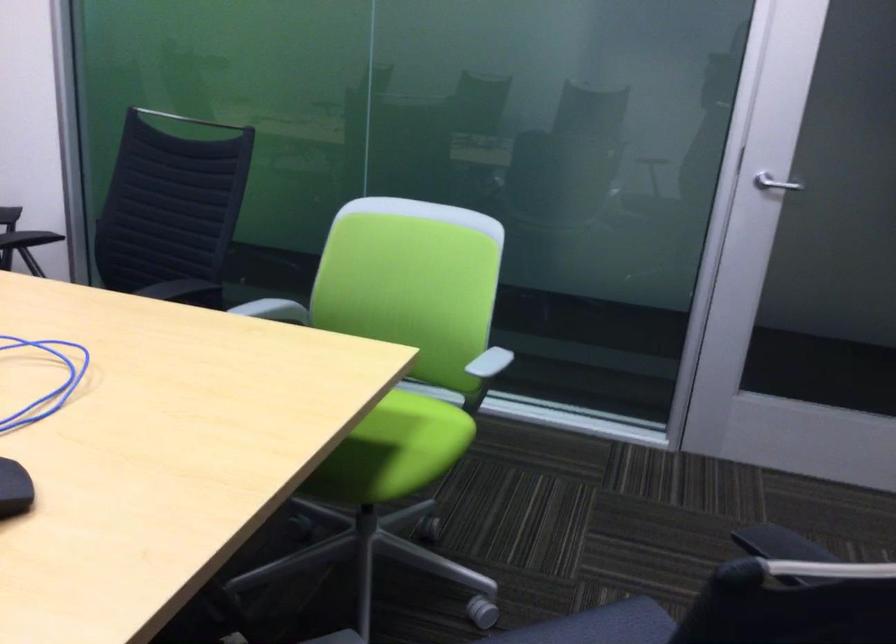
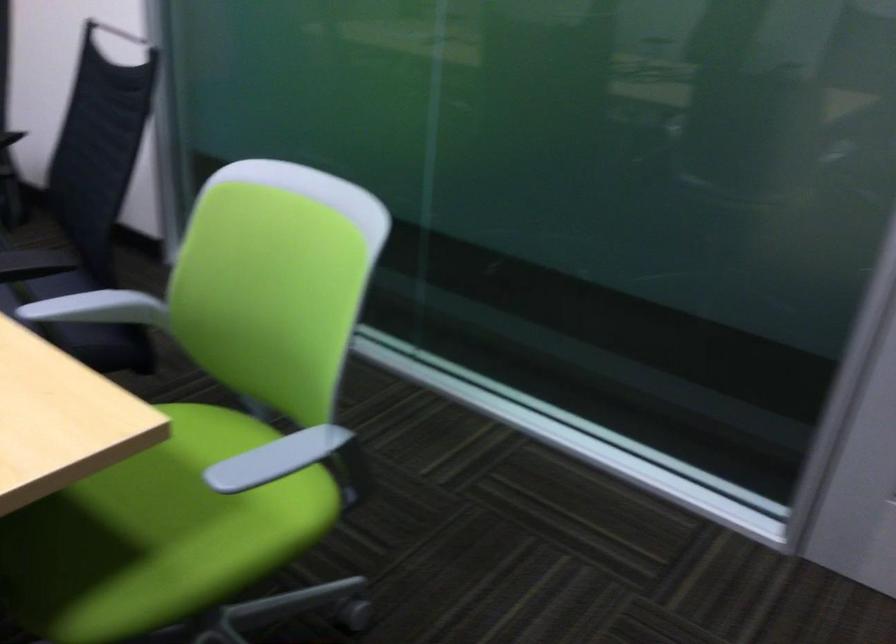
Question: The camera is either moving clockwise (left) or counter-clockwise (right) around the object. The first image is from the beginning of the video and the second image is from the end. Is the camera moving left or right when shooting the video?

Choices:
 (A) Left
 (B) Right

Answer: (B)